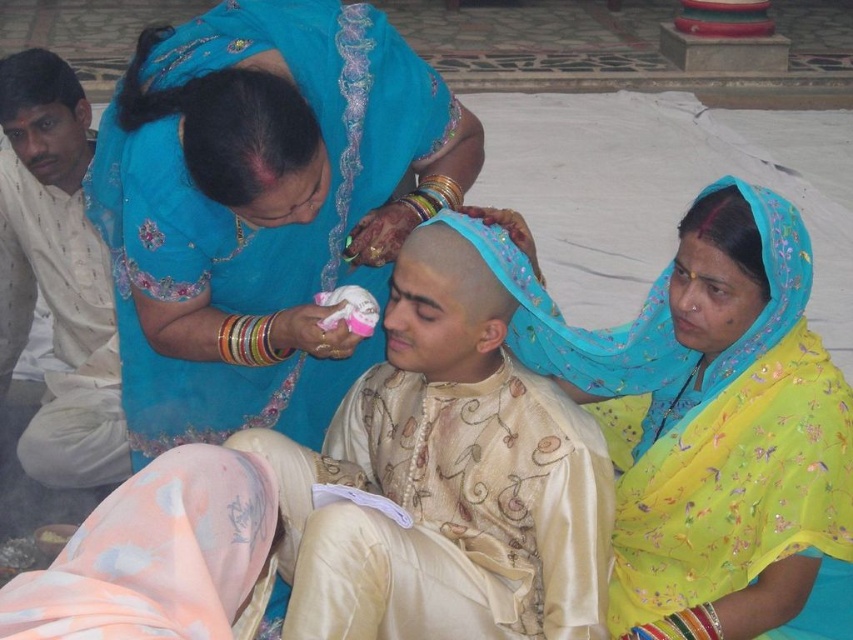
Who is more distant from viewer, [625,464] or [67,211]?

Positioned behind is point [67,211].

The height and width of the screenshot is (640, 853). I want to click on yellow floral saree at center, so click(708, 419).

Who is more forward, (804,385) or (99,320)?

Point (804,385) is more forward.

The width and height of the screenshot is (853, 640). In order to click on yellow floral saree at center in this screenshot , I will do `click(708, 419)`.

Who is shorter, blue silk saree at upper left or matte blue saree at left?

Standing shorter between the two is blue silk saree at upper left.

Can you confirm if blue silk saree at upper left is positioned to the right of matte blue saree at left?

Yes, blue silk saree at upper left is to the right of matte blue saree at left.

This screenshot has height=640, width=853. Identify the location of blue silk saree at upper left. (262, 209).

Is blue silk saree at upper left positioned behind yellow floral saree at center?

No.

Is point (216, 227) farther from viewer compared to point (764, 426)?

That is True.

Is point (222, 355) more distant than point (706, 467)?

Yes, point (222, 355) is behind point (706, 467).

Locate an element on the screen. This screenshot has height=640, width=853. blue silk saree at upper left is located at coordinates (262, 209).